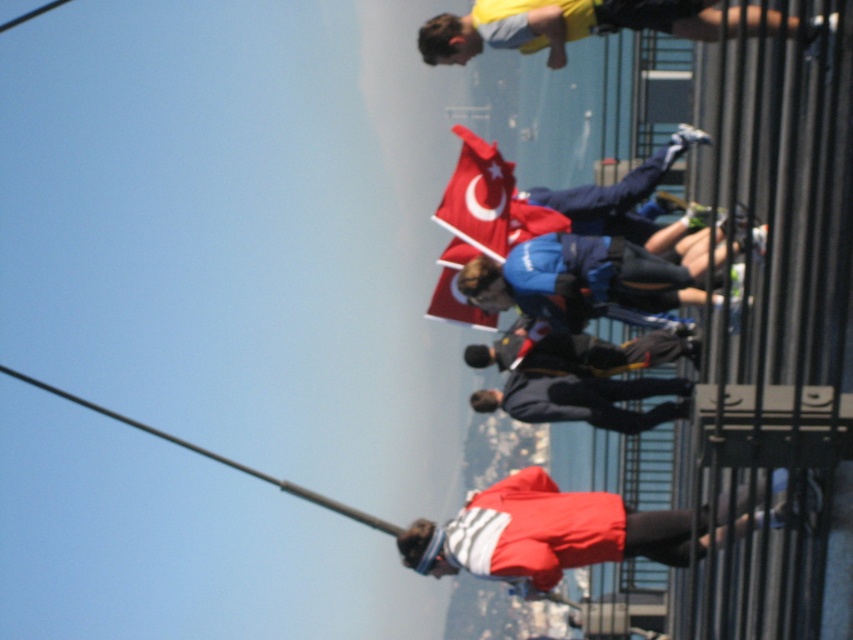
What do you see at coordinates (572, 531) in the screenshot? The image size is (853, 640). I see `red fabric jacket at center` at bounding box center [572, 531].

Find the location of a particular element. red fabric jacket at center is located at coordinates (572, 531).

Does blue fabric jacket at center appear under yellow fabric shirt at upper center?

Correct, blue fabric jacket at center is located below yellow fabric shirt at upper center.

Is blue fabric jacket at center smaller than yellow fabric shirt at upper center?

Yes, blue fabric jacket at center is smaller than yellow fabric shirt at upper center.

Between point (608, 244) and point (569, 4), which one is positioned behind?

The point (569, 4) is behind.

This screenshot has height=640, width=853. Find the location of `blue fabric jacket at center`. blue fabric jacket at center is located at coordinates [x=576, y=278].

Does yellow fabric shirt at upper center have a larger size compared to dark blue fabric jacket at center?

Correct, yellow fabric shirt at upper center is larger in size than dark blue fabric jacket at center.

Which is behind, point (450, 20) or point (500, 339)?

The point (500, 339) is more distant.

The width and height of the screenshot is (853, 640). Identify the location of yellow fabric shirt at upper center. (558, 26).